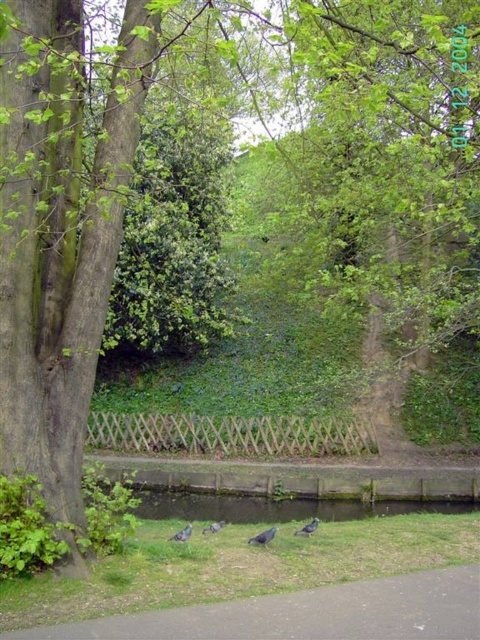
Between green concrete water at lower center and gray matte bird at center, which one appears on the left side from the viewer's perspective?

green concrete water at lower center

Is green concrete water at lower center to the right of gray matte bird at center from the viewer's perspective?

In fact, green concrete water at lower center is to the left of gray matte bird at center.

Does point (347, 512) lie in front of point (213, 528)?

No, it is not.

I want to click on green concrete water at lower center, so click(277, 504).

Is point (191, 531) positioned before point (213, 529)?

Yes, point (191, 531) is closer to viewer.

Is gray matte bird at lower left in front of gray matte bird at center?

Yes.

Image resolution: width=480 pixels, height=640 pixels. Describe the element at coordinates (181, 532) in the screenshot. I see `gray matte bird at lower left` at that location.

Find the location of a particular element. gray matte bird at lower left is located at coordinates (181, 532).

Does purple iridescent bird at center have a greater height compared to gray matte bird at lower center?

No.

Is purple iridescent bird at center above gray matte bird at lower center?

Correct, purple iridescent bird at center is located above gray matte bird at lower center.

Which is in front, point (252, 540) or point (303, 528)?

Point (252, 540) is in front.

You are a GUI agent. You are given a task and a screenshot of the screen. Output one action in this format:
    pyautogui.click(x=<x>, y=<y>)
    Task: Click on the purple iridescent bird at center
    The height and width of the screenshot is (640, 480).
    Given the screenshot: What is the action you would take?
    pyautogui.click(x=264, y=536)